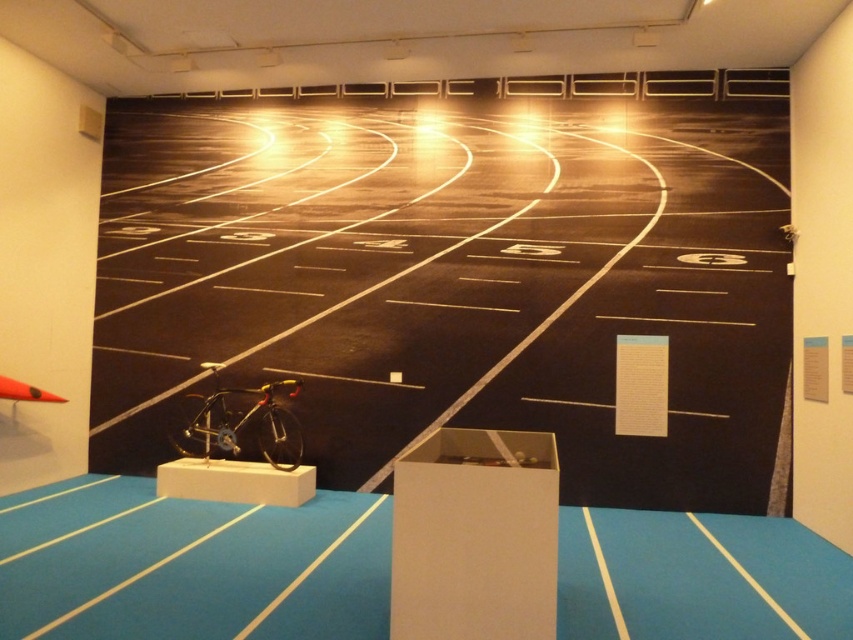
Question: Can you confirm if smooth asphalt race track at center is positioned to the left of shiny metallic bicycle at center?

Choices:
 (A) yes
 (B) no

Answer: (B)

Question: Does smooth asphalt race track at center have a larger size compared to shiny metallic bicycle at center?

Choices:
 (A) yes
 (B) no

Answer: (B)

Question: Is smooth asphalt race track at center to the left of shiny metallic bicycle at center from the viewer's perspective?

Choices:
 (A) yes
 (B) no

Answer: (B)